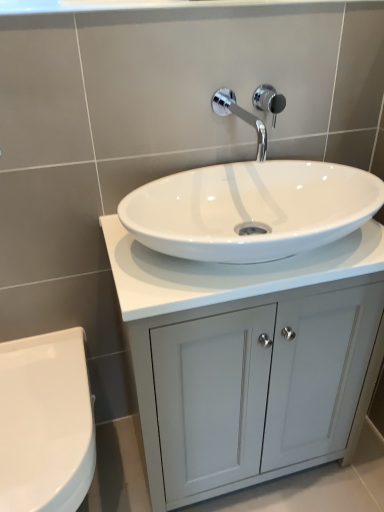
What do you see at coordinates (227, 272) in the screenshot? I see `white glossy countertop at center` at bounding box center [227, 272].

You are a GUI agent. You are given a task and a screenshot of the screen. Output one action in this format:
    pyautogui.click(x=<x>, y=<y>)
    Task: Click on the chrome metallic shower at upper center
    The width and height of the screenshot is (384, 512).
    Given the screenshot: What is the action you would take?
    pyautogui.click(x=268, y=100)

Describe the element at coordinates (248, 360) in the screenshot. I see `white glossy cabinet at center` at that location.

What is the approximate height of white glossy cabinet at center?

75.16 centimeters.

Where is `white glossy countertop at center`? The image size is (384, 512). white glossy countertop at center is located at coordinates (227, 272).

Is point (265, 104) farther from camera compared to point (257, 145)?

That is False.

I want to click on shower lying on the right of chrome metallic faucet at upper center, so click(x=268, y=100).

Looking at this image, is chrome metallic shower at upper center with chrome metallic faucet at upper center?

Yes, chrome metallic shower at upper center and chrome metallic faucet at upper center clearly make contact.

From the image's perspective, is white glossy cabinet at center located above or below chrome metallic shower at upper center?

white glossy cabinet at center is situated lower than chrome metallic shower at upper center in the image.

In the image, there is a chrome metallic shower at upper center. Where is `bathroom cabinet below it (from a real-world perspective)`? Image resolution: width=384 pixels, height=512 pixels. bathroom cabinet below it (from a real-world perspective) is located at coordinates (248, 360).

Which is in front, white glossy cabinet at center or chrome metallic shower at upper center?

white glossy cabinet at center is in front.

From the image's perspective, is white glossy cabinet at center on white glossy countertop at center?

Incorrect, from the image's perspective, white glossy cabinet at center is lower than white glossy countertop at center.

Looking at their sizes, would you say white glossy cabinet at center is wider or thinner than white glossy countertop at center?

white glossy cabinet at center is wider than white glossy countertop at center.

Would you say white glossy cabinet at center is a long distance from white glossy countertop at center?

No, white glossy cabinet at center is not far away from white glossy countertop at center.

Is white glossy cabinet at center located outside white glossy countertop at center?

Absolutely, white glossy cabinet at center is external to white glossy countertop at center.

Based on the photo, is chrome metallic faucet at upper center at the left side of chrome metallic shower at upper center?

Yes, chrome metallic faucet at upper center is to the left of chrome metallic shower at upper center.

From a real-world perspective, does chrome metallic faucet at upper center stand above chrome metallic shower at upper center?

Correct, in the physical world, chrome metallic faucet at upper center is higher than chrome metallic shower at upper center.

Could you measure the distance between chrome metallic faucet at upper center and chrome metallic shower at upper center?

2.30 inches.

Can you confirm if chrome metallic faucet at upper center is thinner than chrome metallic shower at upper center?

In fact, chrome metallic faucet at upper center might be wider than chrome metallic shower at upper center.

Considering the positions of point (265, 140) and point (340, 241), is point (265, 140) closer or farther from the camera than point (340, 241)?

Point (265, 140) is positioned farther from the camera compared to point (340, 241).

Can you tell me how much chrome metallic faucet at upper center and white glossy countertop at center differ in facing direction?

1.81 degrees separate the facing orientations of chrome metallic faucet at upper center and white glossy countertop at center.

In the image, there is a chrome metallic faucet at upper center. At what (x,y) coordinates should I click in order to perform the action: click on counter top below it (from the image's perspective). Please return your answer as a coordinate pair (x, y). Looking at the image, I should click on (227, 272).

Is chrome metallic faucet at upper center surrounding white glossy countertop at center?

No, white glossy countertop at center is not a part of chrome metallic faucet at upper center.

Considering the sizes of objects white glossy toilet at lower left and white glossy countertop at center in the image provided, who is wider, white glossy toilet at lower left or white glossy countertop at center?

white glossy toilet at lower left.

How different are the orientations of white glossy toilet at lower left and white glossy countertop at center in degrees?

0.404 degrees separate the facing orientations of white glossy toilet at lower left and white glossy countertop at center.

Is white glossy toilet at lower left looking in the opposite direction of white glossy countertop at center?

No.

Between white glossy toilet at lower left and white glossy countertop at center, which one has larger size?

Bigger between the two is white glossy toilet at lower left.

From the picture: From a real-world perspective, is white glossy toilet at lower left physically located above or below white glossy cabinet at center?

In terms of real-world spatial position, white glossy toilet at lower left is below white glossy cabinet at center.

At what (x,y) coordinates should I click in order to perform the action: click on toilet below the white glossy cabinet at center (from a real-world perspective). Please return your answer as a coordinate pair (x, y). The image size is (384, 512). Looking at the image, I should click on (45, 423).

Between white glossy toilet at lower left and white glossy cabinet at center, which one is positioned behind?

Positioned behind is white glossy cabinet at center.

Identify the location of tap lying in front of the chrome metallic shower at upper center. The height and width of the screenshot is (512, 384). (240, 117).

The image size is (384, 512). What are the coordinates of `shower behind the white glossy cabinet at center` in the screenshot? It's located at (268, 100).

Considering their positions, is white glossy cabinet at center positioned closer to white glossy toilet at lower left than chrome metallic faucet at upper center?

white glossy cabinet at center is closer to white glossy toilet at lower left.

Considering their positions, is chrome metallic shower at upper center positioned further to white glossy cabinet at center than chrome metallic faucet at upper center?

chrome metallic shower at upper center.

From the image, which object appears to be farther from white glossy cabinet at center, white glossy toilet at lower left or chrome metallic shower at upper center?

Among the two, chrome metallic shower at upper center is located further to white glossy cabinet at center.

When comparing their distances from white glossy countertop at center, does chrome metallic shower at upper center or chrome metallic faucet at upper center seem closer?

Based on the image, chrome metallic faucet at upper center appears to be nearer to white glossy countertop at center.

Looking at the image, which one is located further to chrome metallic shower at upper center, chrome metallic faucet at upper center or white glossy toilet at lower left?

Based on the image, white glossy toilet at lower left appears to be further to chrome metallic shower at upper center.

Based on their spatial positions, is white glossy toilet at lower left or chrome metallic faucet at upper center closer to chrome metallic shower at upper center?

chrome metallic faucet at upper center lies closer to chrome metallic shower at upper center than the other object.

Looking at the image, which one is located closer to chrome metallic faucet at upper center, white glossy countertop at center or white glossy cabinet at center?

The object closer to chrome metallic faucet at upper center is white glossy countertop at center.

Based on their spatial positions, is chrome metallic faucet at upper center or white glossy cabinet at center closer to white glossy countertop at center?

white glossy cabinet at center is positioned closer to the anchor white glossy countertop at center.

The height and width of the screenshot is (512, 384). I want to click on bathroom cabinet between chrome metallic faucet at upper center and white glossy toilet at lower left in the vertical direction, so click(x=248, y=360).

Where is `bathroom cabinet between chrome metallic shower at upper center and white glossy toilet at lower left vertically`? Image resolution: width=384 pixels, height=512 pixels. bathroom cabinet between chrome metallic shower at upper center and white glossy toilet at lower left vertically is located at coordinates tap(248, 360).

The image size is (384, 512). I want to click on tap between chrome metallic shower at upper center and white glossy toilet at lower left in the vertical direction, so click(x=240, y=117).

The image size is (384, 512). In order to click on counter top between chrome metallic faucet at upper center and white glossy cabinet at center in the vertical direction in this screenshot , I will do `click(227, 272)`.